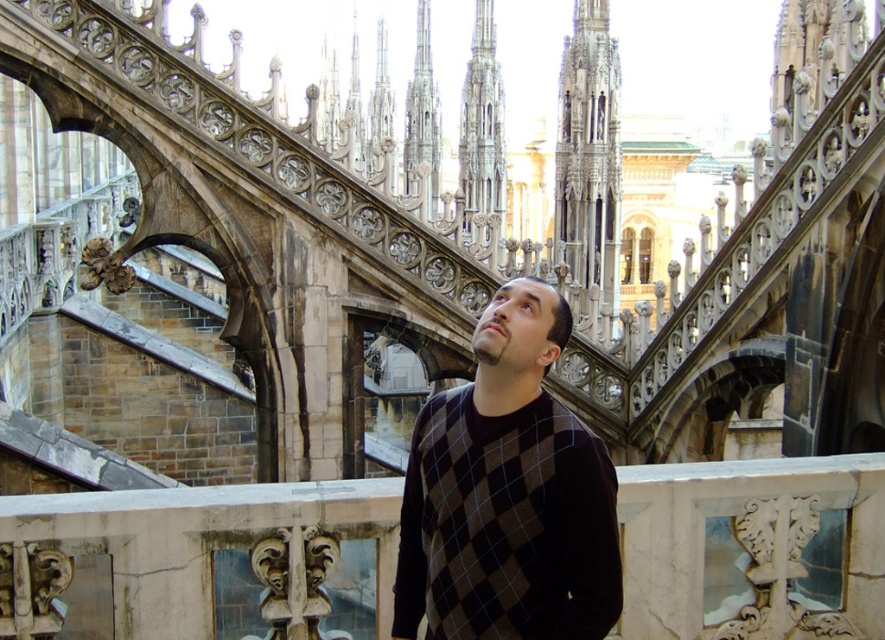
Question: Estimate the real-world distances between objects in this image. Which object is closer to the polished stone tower at center?

Choices:
 (A) gray stone spire at upper center
 (B) dark brown sweater at center

Answer: (B)

Question: Is dark brown sweater at center positioned before polished stone tower at center?

Choices:
 (A) no
 (B) yes

Answer: (B)

Question: Is dark brown sweater at center positioned before gray stone spire at upper center?

Choices:
 (A) no
 (B) yes

Answer: (B)

Question: Can you confirm if dark brown sweater at center is positioned below polished stone tower at center?

Choices:
 (A) yes
 (B) no

Answer: (A)

Question: Based on their relative distances, which object is farther from the gray stone spire at upper center?

Choices:
 (A) dark brown sweater at center
 (B) polished stone tower at center

Answer: (B)

Question: Based on their relative distances, which object is farther from the dark brown sweater at center?

Choices:
 (A) gray stone spire at upper center
 (B) polished stone tower at center

Answer: (A)